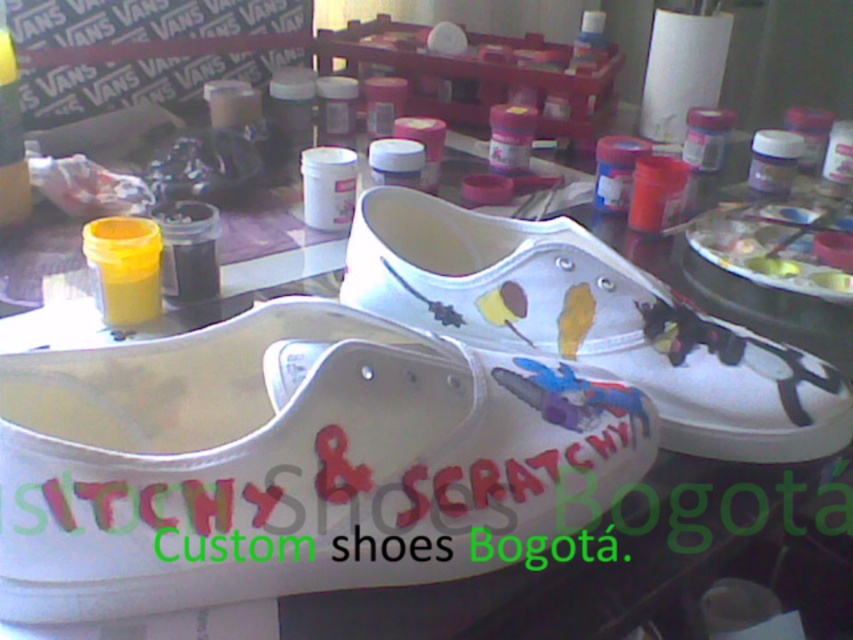
You are holding a paintbrush and want to reach the point at coordinates point (525, 512) on the table. Your hand is currently 18 inches away from the table. Can you reach that point without moving your hand closer?

The point (525, 512) is 16.10 inches from the viewer, and your hand is 18 inches away, so you can reach it without moving closer.

Based on the photo, you are an artist who wants to place both the white matte shoe at center and the white canvas shoe at center on a shelf. Given their sizes, which one should you place first to maximize shelf space efficiency?

The white matte shoe at center occupies less space than the white canvas shoe at center, so you should place the white matte shoe at center first to leave more space for the larger white canvas shoe at center.

You are an artist looking at the table with art supplies. You notice two points on the table. The first point is at coordinate (373, 483) and the second is at (380, 257). Which point is closer to you?

Point (373, 483) is closer to the viewer than point (380, 257).